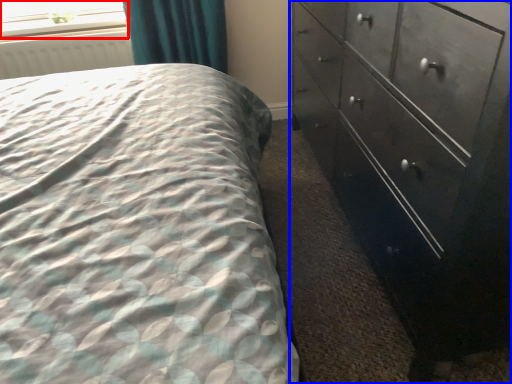
Question: Among these objects, which one is farthest to the camera, window screen (highlighted by a red box) or chest of drawers (highlighted by a blue box)?

Choices:
 (A) window screen
 (B) chest of drawers

Answer: (A)